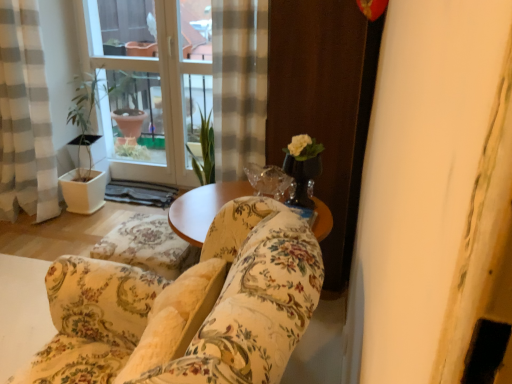
Question: Does wooden screen door at right lie in front of gray checkered curtain at left?

Choices:
 (A) no
 (B) yes

Answer: (B)

Question: Is wooden screen door at right positioned beyond the bounds of gray checkered curtain at left?

Choices:
 (A) no
 (B) yes

Answer: (B)

Question: Does wooden screen door at right have a greater height compared to gray checkered curtain at left?

Choices:
 (A) no
 (B) yes

Answer: (B)

Question: Is wooden screen door at right facing away from gray checkered curtain at left?

Choices:
 (A) no
 (B) yes

Answer: (A)

Question: Is wooden screen door at right surrounding gray checkered curtain at left?

Choices:
 (A) yes
 (B) no

Answer: (B)

Question: Considering the positions of wooden screen door at right and transparent glass vase at center in the image, is wooden screen door at right wider or thinner than transparent glass vase at center?

Choices:
 (A) thin
 (B) wide

Answer: (B)

Question: Is point (364, 132) closer or farther from the camera than point (285, 160)?

Choices:
 (A) closer
 (B) farther

Answer: (B)

Question: Visually, is wooden screen door at right positioned to the left or to the right of transparent glass vase at center?

Choices:
 (A) left
 (B) right

Answer: (B)

Question: From the image's perspective, is wooden screen door at right located above or below transparent glass vase at center?

Choices:
 (A) above
 (B) below

Answer: (A)

Question: In terms of width, does floral fabric couch at center look wider or thinner when compared to gray checkered curtain at left?

Choices:
 (A) thin
 (B) wide

Answer: (B)

Question: From a real-world perspective, is floral fabric couch at center above or below gray checkered curtain at left?

Choices:
 (A) below
 (B) above

Answer: (A)

Question: In terms of height, does floral fabric couch at center look taller or shorter compared to gray checkered curtain at left?

Choices:
 (A) short
 (B) tall

Answer: (A)

Question: Is point (231, 286) closer or farther from the camera than point (31, 72)?

Choices:
 (A) closer
 (B) farther

Answer: (A)

Question: Which is correct: transparent glass vase at center is inside floral fabric couch at center, or outside of it?

Choices:
 (A) inside
 (B) outside

Answer: (B)

Question: From a real-world perspective, is transparent glass vase at center above or below floral fabric couch at center?

Choices:
 (A) above
 (B) below

Answer: (A)